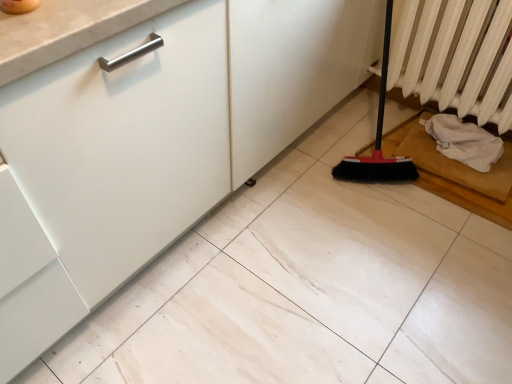
Find the location of a particular element. The image size is (512, 384). free space above white fabric at lower right (from a real-world perspective) is located at coordinates (467, 124).